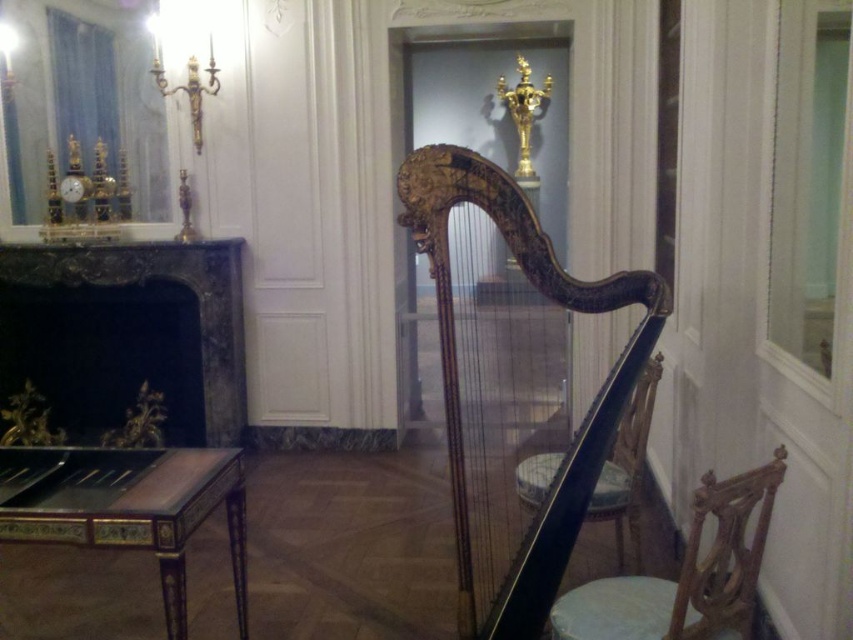
You are standing in the room and want to place a small decorative item between the two points labeled point (534, 467) and point (627, 474). Given that the item must be placed closer to the viewer than both points, is this possible?

Point (534, 467) is closer to the viewer than point (627, 474). Since the item must be placed closer than both points, but the closest point is already point (534, 467), it is not possible to place the item closer to the viewer than both points.

You are standing in the room and want to move from the black marble fireplace at left to the smooth white stool at lower right. Which direction should you move to get closer to the stool?

You should move towards the smooth white stool at lower right because it is closer to you than the black marble fireplace at left, which is further away.

You are standing at the point marked as point (625, 467) in the room. What object is located exactly at that point?

The wooden chair at center is located exactly at point (625, 467).